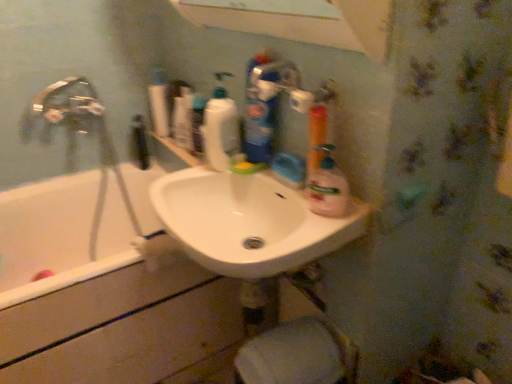
Question: Considering the positions of point (155, 91) and point (224, 167), is point (155, 91) closer or farther from the camera than point (224, 167)?

Choices:
 (A) farther
 (B) closer

Answer: (A)

Question: From a real-world perspective, is white glossy bottle at upper center, which is the fourth cleaning product from front to back, physically located above or below translucent plastic bottle at upper center, marked as the 2th cleaning product in a back-to-front arrangement?

Choices:
 (A) above
 (B) below

Answer: (B)

Question: Which of these objects is positioned closest to the white matte toilet paper at lower center?

Choices:
 (A) white glossy sink at center
 (B) white glossy bottle at upper center, which appears as the 4th cleaning product when viewed from the right
 (C) blue glossy bottle at upper center, which ranks as the 2th cleaning product in front-to-back order
 (D) black glossy bottle at upper center
 (E) white glossy bathtub at left

Answer: (A)

Question: Estimate the real-world distances between objects in this image. Which object is farther from the white glossy bottle at upper center, the 1th cleaning product from the left?

Choices:
 (A) blue glossy bottle at upper center, which ranks as the 2th cleaning product in front-to-back order
 (B) white matte toilet paper at lower center
 (C) white glossy bathtub at left
 (D) translucent plastic spray bottle at center, the fourth cleaning product when ordered from left to right
 (E) translucent plastic bottle at upper center, arranged as the 3th cleaning product when viewed from the front

Answer: (B)